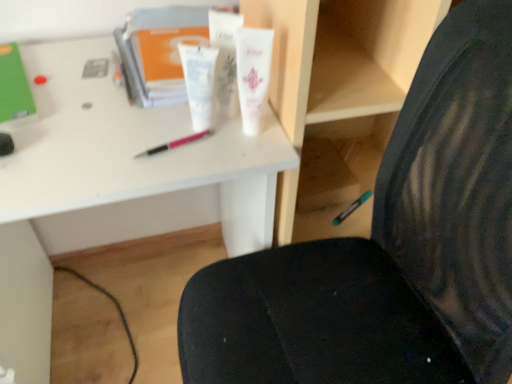
You are a GUI agent. You are given a task and a screenshot of the screen. Output one action in this format:
    pyautogui.click(x=<x>, y=<y>)
    Task: Click on the vacant area in front of white plastic book at upper center
    
    Given the screenshot: What is the action you would take?
    pyautogui.click(x=135, y=137)